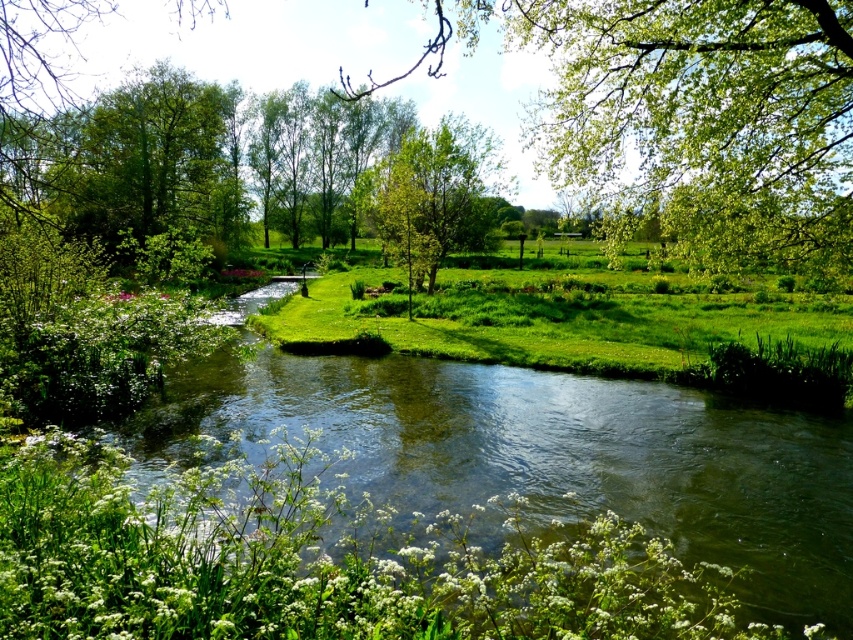
Question: Among these objects, which one is farthest from the camera?

Choices:
 (A) green leafy tree at upper right
 (B) green leafy tree at upper left
 (C) green grass at center
 (D) green leafy tree at center

Answer: (B)

Question: Based on their relative distances, which object is nearer to the green grass at center?

Choices:
 (A) green leafy tree at upper right
 (B) green leafy tree at center
 (C) green leafy tree at upper left

Answer: (B)

Question: Is green leafy tree at upper right below green leafy tree at center?

Choices:
 (A) yes
 (B) no

Answer: (B)

Question: Is green leafy tree at upper left to the left of green leafy tree at center from the viewer's perspective?

Choices:
 (A) yes
 (B) no

Answer: (A)

Question: Considering the relative positions of green leafy tree at upper right and green leafy tree at center in the image provided, where is green leafy tree at upper right located with respect to green leafy tree at center?

Choices:
 (A) above
 (B) below

Answer: (A)

Question: Which of the following is the farthest from the observer?

Choices:
 (A) green leafy tree at center
 (B) green grass at center
 (C) green leafy tree at upper right

Answer: (A)